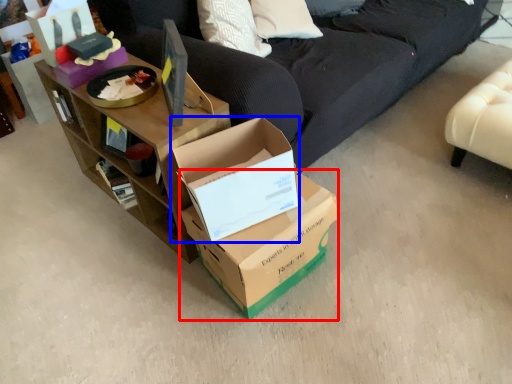
Question: Which point is further to the camera, box (highlighted by a red box) or box (highlighted by a blue box)?

Choices:
 (A) box
 (B) box

Answer: (A)